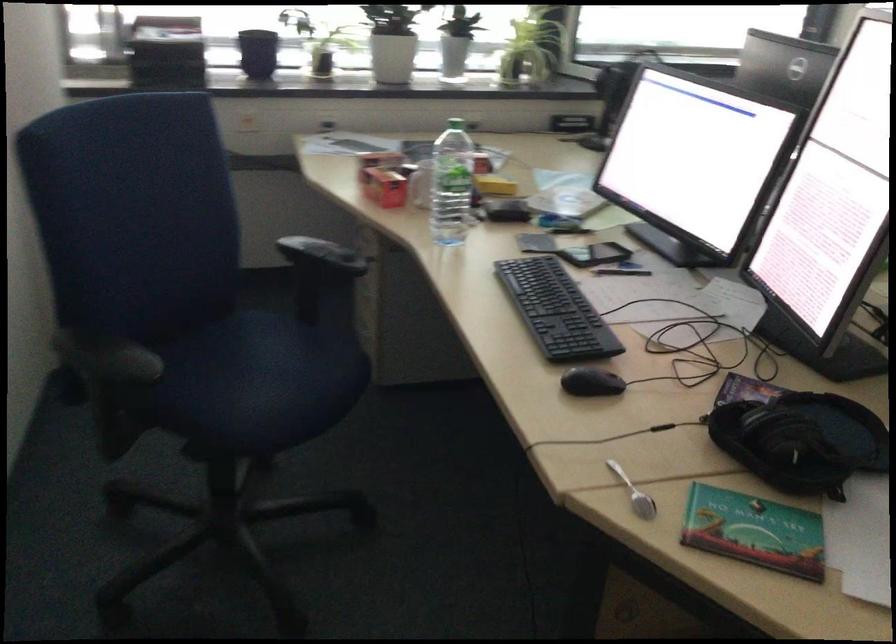
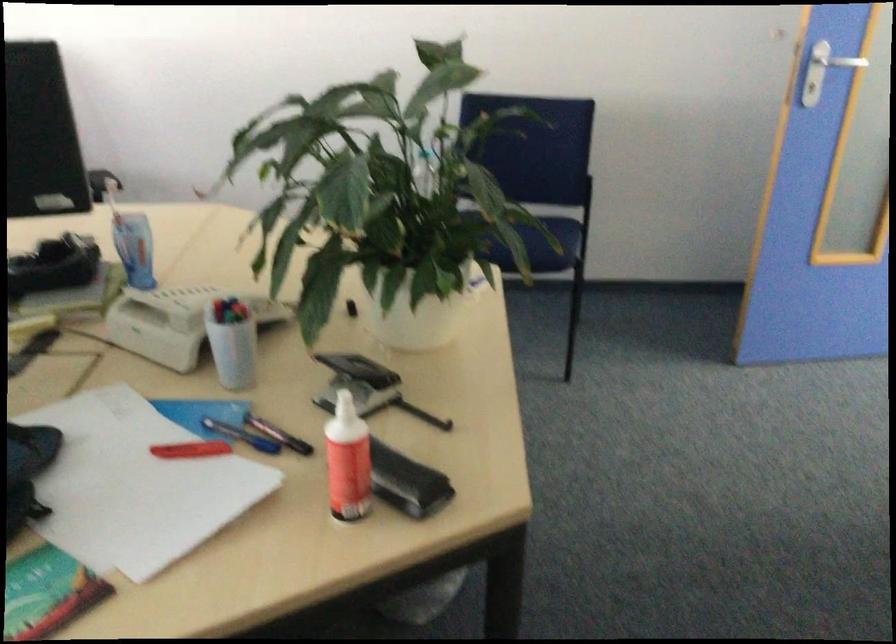
The first image is from the beginning of the video and the second image is from the end. How did the camera likely rotate when shooting the video?

The rotation direction of the camera is right-down.